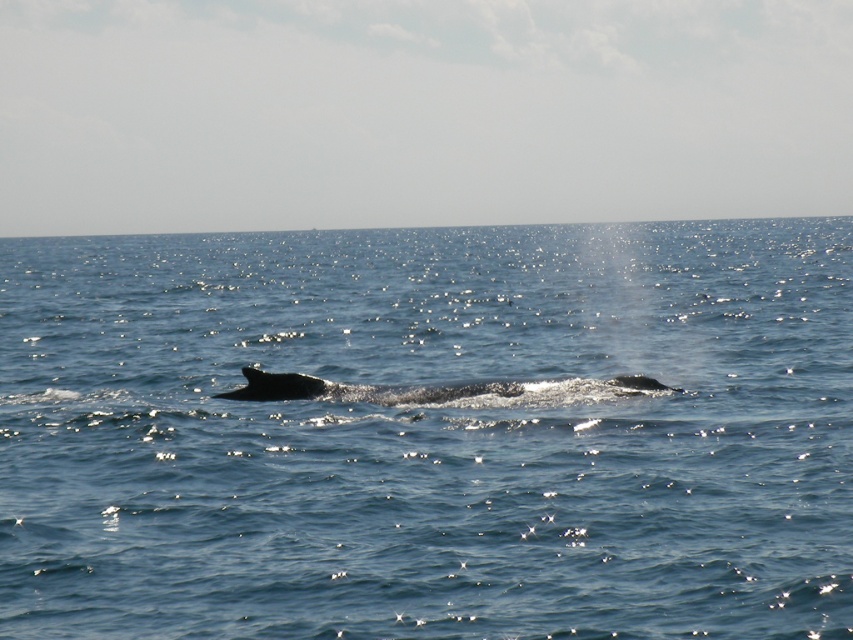
Question: Is blue water at center above gray smooth whale at center?

Choices:
 (A) yes
 (B) no

Answer: (A)

Question: Which point appears farthest from the camera in this image?

Choices:
 (A) (254, 369)
 (B) (767, 566)

Answer: (A)

Question: Can you confirm if blue water at center is positioned above gray smooth whale at center?

Choices:
 (A) yes
 (B) no

Answer: (A)

Question: Among these objects, which one is farthest from the camera?

Choices:
 (A) blue water at center
 (B) gray smooth whale at center

Answer: (B)

Question: Is blue water at center to the left of gray smooth whale at center from the viewer's perspective?

Choices:
 (A) yes
 (B) no

Answer: (A)